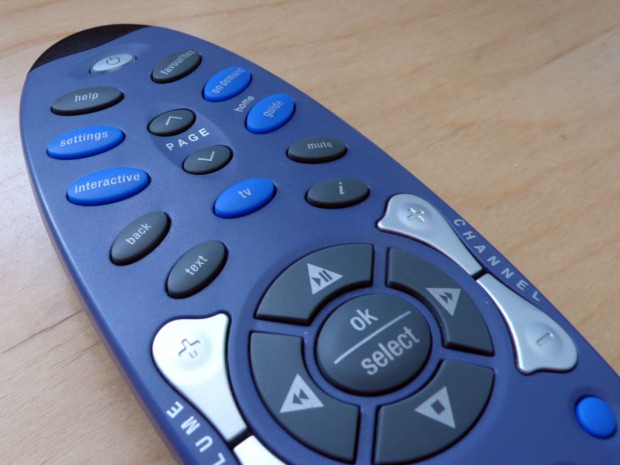
What are the coordinates of `tv` in the screenshot? It's located at (327, 150).